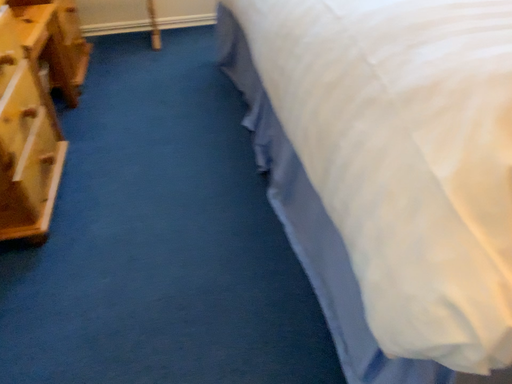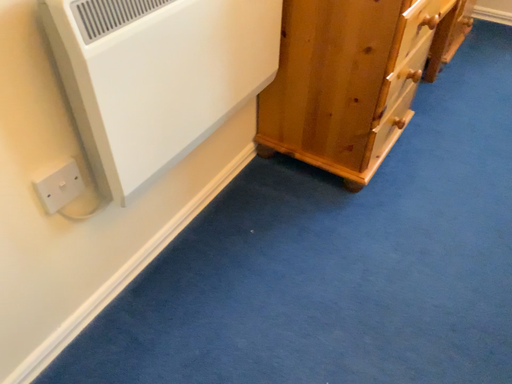
Question: Which way did the camera rotate in the video?

Choices:
 (A) rotated downward
 (B) rotated upward

Answer: (B)